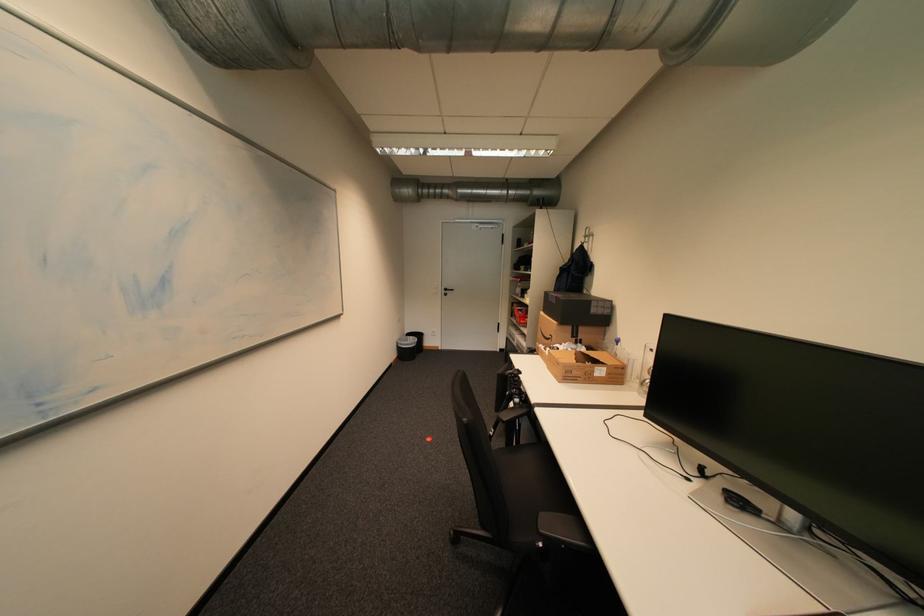
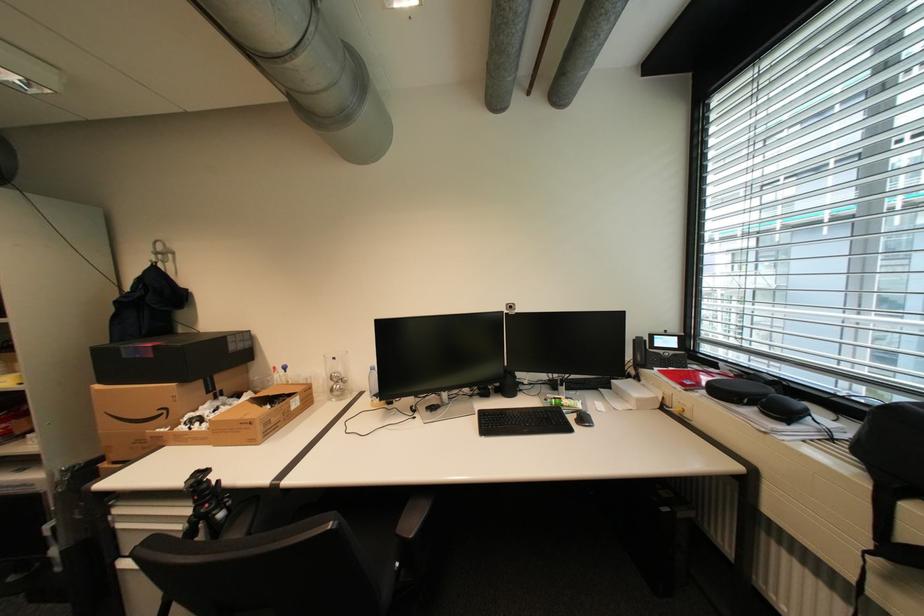
Locate, in the second image, the point that corresponds to the point at 593,237 in the first image.

(165, 254)